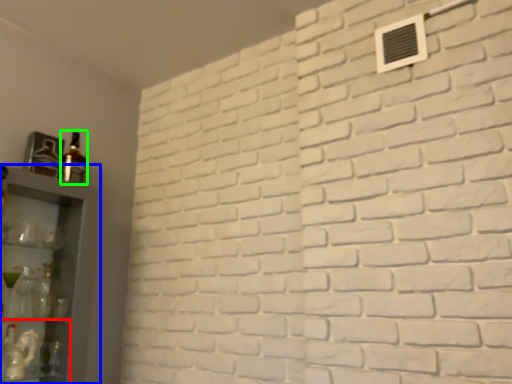
Question: Considering the real-world distances, which object is farthest from shelf (highlighted by a red box)? shelf (highlighted by a blue box) or bottle (highlighted by a green box)?

Choices:
 (A) shelf
 (B) bottle

Answer: (B)